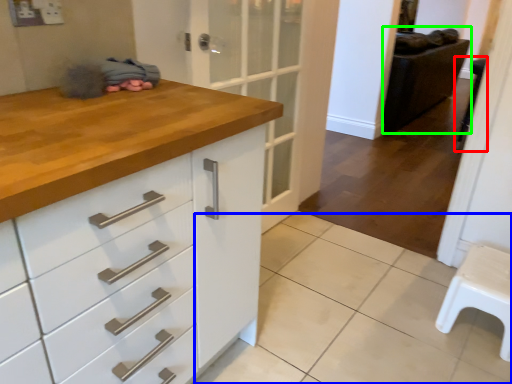
Question: Based on their relative distances, which object is farther from step stool (highlighted by a red box)? Choose from tile (highlighted by a blue box) and chair (highlighted by a green box).

Choices:
 (A) tile
 (B) chair

Answer: (B)